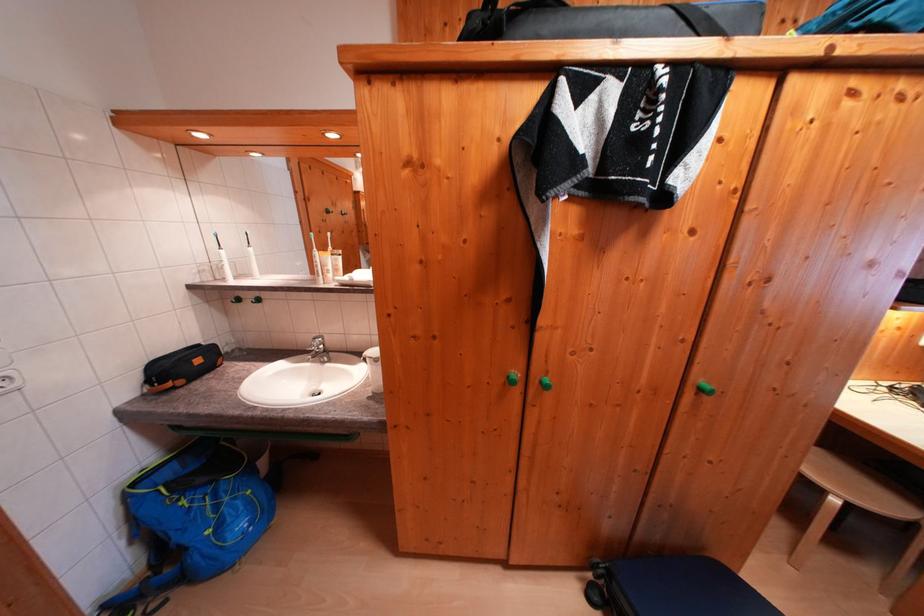
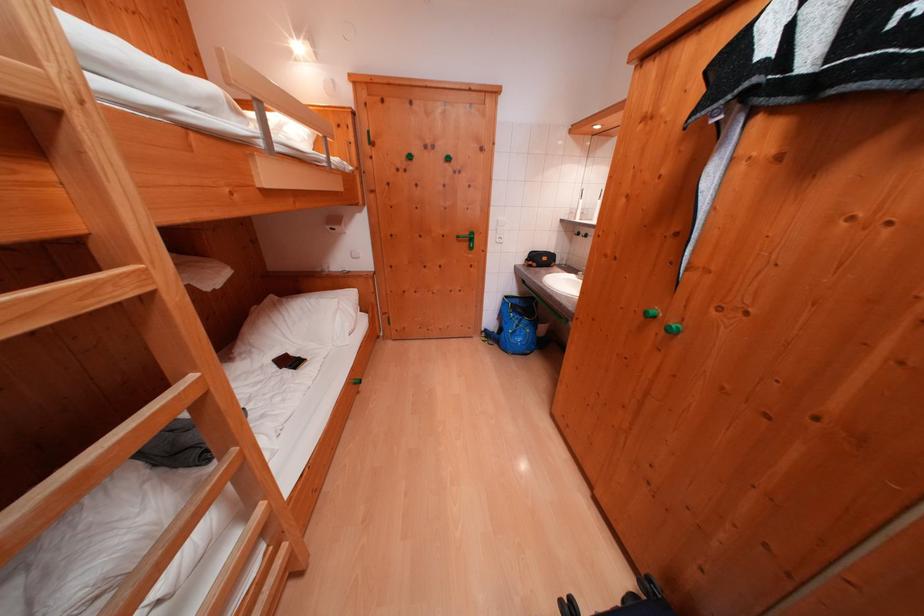
The point at (142, 488) is marked in the first image. Where is the corresponding point in the second image?

(515, 301)